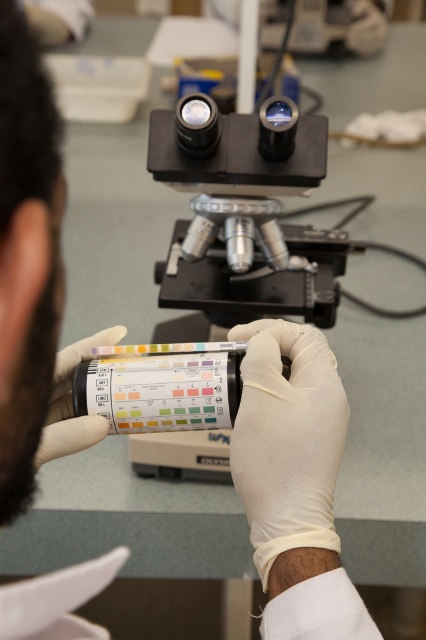
Question: Which point is farther from the camera taking this photo?

Choices:
 (A) pyautogui.click(x=245, y=332)
 (B) pyautogui.click(x=74, y=442)
 (C) pyautogui.click(x=236, y=269)

Answer: (C)

Question: Can you confirm if white latex glove at center is positioned above white matte glove at center?

Choices:
 (A) yes
 (B) no

Answer: (B)

Question: Which object is closer to the camera taking this photo?

Choices:
 (A) white matte glove at center
 (B) metallic silver microscope at center

Answer: (A)

Question: Estimate the real-world distances between objects in this image. Which object is farther from the white latex glove at center?

Choices:
 (A) white matte glove at center
 (B) metallic silver microscope at center

Answer: (B)

Question: Is white latex glove at center to the left of white matte glove at center from the viewer's perspective?

Choices:
 (A) yes
 (B) no

Answer: (B)

Question: Can you confirm if white latex glove at center is positioned below white matte glove at center?

Choices:
 (A) no
 (B) yes

Answer: (B)